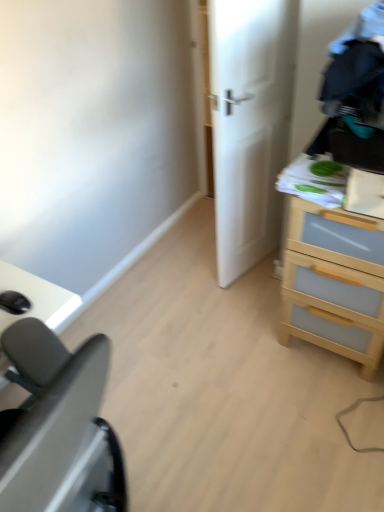
Question: From the image's perspective, would you say black matte desk at lower left is positioned over light wood chest of drawers at right?

Choices:
 (A) yes
 (B) no

Answer: (B)

Question: Is the position of black matte desk at lower left more distant than that of light wood chest of drawers at right?

Choices:
 (A) no
 (B) yes

Answer: (A)

Question: Would you say black matte desk at lower left is outside light wood chest of drawers at right?

Choices:
 (A) yes
 (B) no

Answer: (A)

Question: Considering the relative sizes of black matte desk at lower left and light wood chest of drawers at right in the image provided, is black matte desk at lower left bigger than light wood chest of drawers at right?

Choices:
 (A) yes
 (B) no

Answer: (A)

Question: Is the surface of black matte desk at lower left in direct contact with light wood chest of drawers at right?

Choices:
 (A) no
 (B) yes

Answer: (A)

Question: From the image's perspective, is black matte desk at lower left positioned above or below white matte door at center?

Choices:
 (A) above
 (B) below

Answer: (B)

Question: Is black matte desk at lower left spatially inside white matte door at center, or outside of it?

Choices:
 (A) inside
 (B) outside

Answer: (B)

Question: Is black matte desk at lower left wider or thinner than white matte door at center?

Choices:
 (A) wide
 (B) thin

Answer: (A)

Question: Is black matte desk at lower left taller or shorter than white matte door at center?

Choices:
 (A) tall
 (B) short

Answer: (B)

Question: In the image, is light wood chest of drawers at right on the left side or the right side of white matte door at center?

Choices:
 (A) right
 (B) left

Answer: (A)

Question: Considering the positions of light wood chest of drawers at right and white matte door at center in the image, is light wood chest of drawers at right bigger or smaller than white matte door at center?

Choices:
 (A) big
 (B) small

Answer: (A)

Question: Is light wood chest of drawers at right inside the boundaries of white matte door at center, or outside?

Choices:
 (A) inside
 (B) outside

Answer: (B)

Question: From the image's perspective, relative to white matte door at center, is light wood chest of drawers at right above or below?

Choices:
 (A) above
 (B) below

Answer: (B)

Question: From a real-world perspective, relative to light wood chest of drawers at right, is white matte door at center vertically above or below?

Choices:
 (A) below
 (B) above

Answer: (B)

Question: Considering the positions of point (254, 64) and point (291, 167), is point (254, 64) closer or farther from the camera than point (291, 167)?

Choices:
 (A) closer
 (B) farther

Answer: (B)